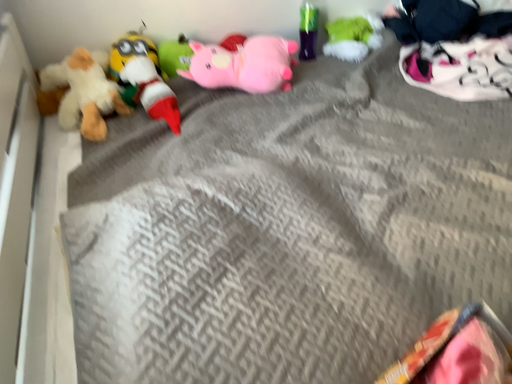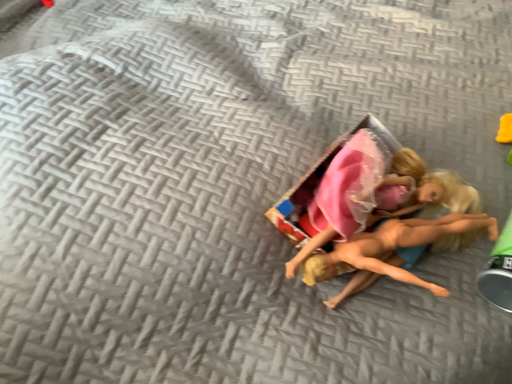
Question: Which way did the camera rotate in the video?

Choices:
 (A) rotated upward
 (B) rotated downward

Answer: (B)